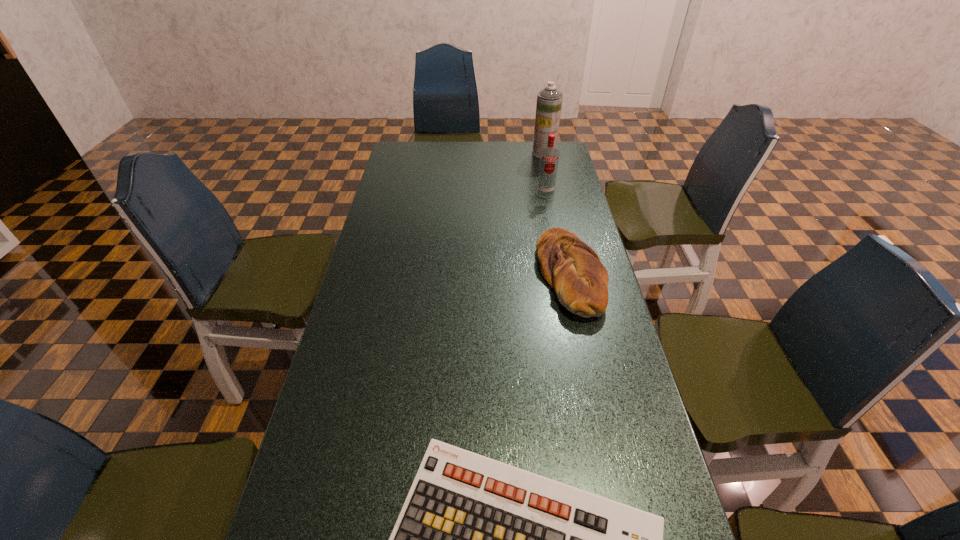
Identify the location of aerosol can located at the right edge. The height and width of the screenshot is (540, 960). (549, 100).

What are the coordinates of `vodka situated at the right edge` in the screenshot? It's located at (549, 156).

This screenshot has height=540, width=960. Identify the location of bread positioned at the right edge. (573, 269).

Find the location of a particular element. object at the far right corner is located at coordinates (549, 100).

In the image, there is a desktop. Identify the location of vacant space at the far edge. The width and height of the screenshot is (960, 540). (468, 148).

I want to click on vacant space at the left edge of the desktop, so click(x=386, y=279).

Where is `free space at the right edge of the desktop`? free space at the right edge of the desktop is located at coordinates (669, 507).

Find the location of a particular element. unoccupied position between the second shortest object and the aerosol can is located at coordinates (557, 213).

The height and width of the screenshot is (540, 960). What are the coordinates of `free space between the third farthest object and the tallest object` in the screenshot? It's located at (557, 213).

Select which object is the third closest to the second tallest object. Please provide its 2D coordinates. Your answer should be formatted as a tuple, i.e. [(x, y)], where the tuple contains the x and y coordinates of a point satisfying the conditions above.

[(477, 539)]